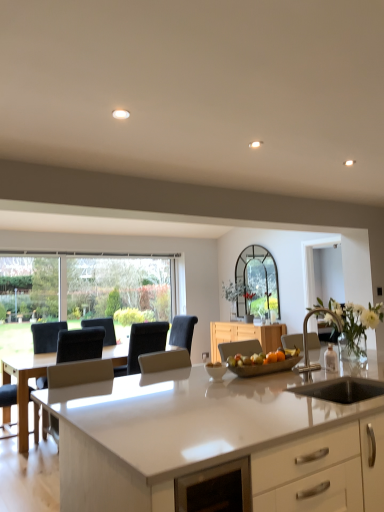
Question: Which direction should I rotate to face black fabric armchair at center, the 3th armchair when ordered from front to back, — up or down?

Choices:
 (A) up
 (B) down

Answer: (B)

Question: Can you confirm if white leather armchair at left, the third armchair in the right-to-left sequence, is taller than satin silver armchair at center, which ranks as the 1th armchair in right-to-left order?

Choices:
 (A) yes
 (B) no

Answer: (A)

Question: Is white leather armchair at left, the 2th armchair in the front-to-back sequence, next to satin silver armchair at center, which is counted as the third armchair, starting from the back, and touching it?

Choices:
 (A) no
 (B) yes

Answer: (A)

Question: Is the depth of white leather armchair at left, placed as the 1th armchair when sorted from left to right, greater than that of satin silver armchair at center, the first armchair viewed from the front?

Choices:
 (A) no
 (B) yes

Answer: (B)

Question: Is white leather armchair at left, the second armchair in the back-to-front sequence, aimed at satin silver armchair at center, marked as the 3th armchair in a left-to-right arrangement?

Choices:
 (A) no
 (B) yes

Answer: (A)

Question: From a real-world perspective, is white leather armchair at left, the third armchair in the right-to-left sequence, on satin silver armchair at center, marked as the 3th armchair in a left-to-right arrangement?

Choices:
 (A) yes
 (B) no

Answer: (B)

Question: Are white leather armchair at left, the 2th armchair in the front-to-back sequence, and satin silver armchair at center, the first armchair viewed from the front, far apart?

Choices:
 (A) no
 (B) yes

Answer: (B)

Question: Does black fabric armchair at center, the 3th armchair when ordered from front to back, appear on the left side of white leather armchair at left, the 2th armchair in the front-to-back sequence?

Choices:
 (A) no
 (B) yes

Answer: (A)

Question: Does black fabric armchair at center, the 2th armchair when ordered from left to right, have a greater width compared to white leather armchair at left, the 2th armchair in the front-to-back sequence?

Choices:
 (A) no
 (B) yes

Answer: (B)

Question: Is black fabric armchair at center, the 3th armchair when ordered from front to back, outside of white leather armchair at left, placed as the 1th armchair when sorted from left to right?

Choices:
 (A) yes
 (B) no

Answer: (A)

Question: From a real-world perspective, is black fabric armchair at center, the 2th armchair when ordered from left to right, over white leather armchair at left, the 2th armchair in the front-to-back sequence?

Choices:
 (A) yes
 (B) no

Answer: (A)

Question: Is black fabric armchair at center, which is the 2th armchair in right-to-left order, smaller than white leather armchair at left, the second armchair in the back-to-front sequence?

Choices:
 (A) no
 (B) yes

Answer: (B)

Question: Is black fabric armchair at center, which is the 2th armchair in right-to-left order, closer to camera compared to white leather armchair at left, the second armchair in the back-to-front sequence?

Choices:
 (A) yes
 (B) no

Answer: (B)

Question: Is black fabric armchair at center, which is the 2th armchair in right-to-left order, positioned with its back to metallic silver tray at center?

Choices:
 (A) no
 (B) yes

Answer: (B)